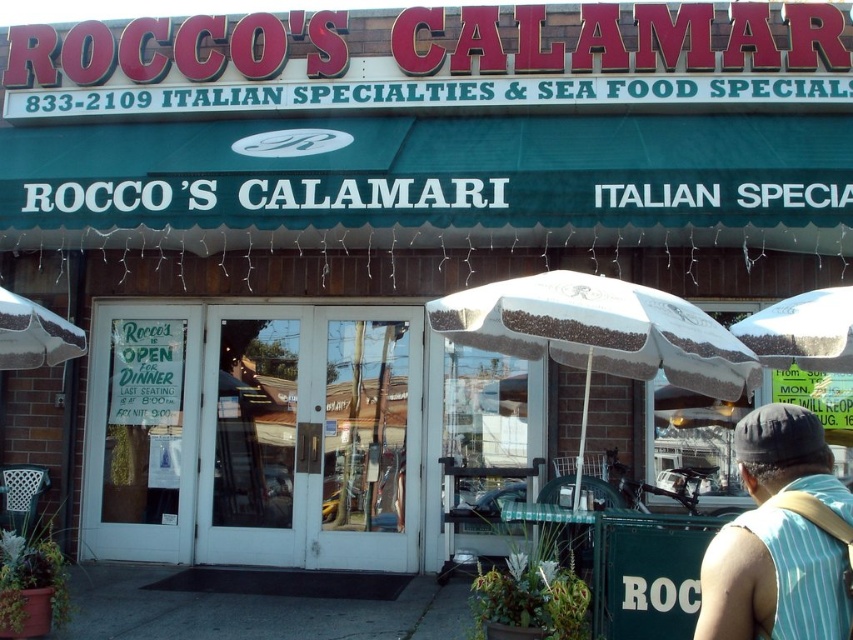
In the scene shown: Which of these two, white textured umbrella at center or white textured umbrella at left, stands shorter?

Standing shorter between the two is white textured umbrella at left.

The width and height of the screenshot is (853, 640). I want to click on white textured umbrella at center, so click(x=599, y=332).

Find the location of a particular element. The width and height of the screenshot is (853, 640). white textured umbrella at center is located at coordinates (599, 332).

Based on the photo, which of these two, white textured umbrella at center or striped sleeveless shirt at lower right, stands taller?

white textured umbrella at center is taller.

Is point (561, 321) farther from viewer compared to point (753, 483)?

Yes.

The height and width of the screenshot is (640, 853). Identify the location of white textured umbrella at center. (599, 332).

Can you confirm if white fabric umbrella at center is thinner than white textured umbrella at left?

Indeed, white fabric umbrella at center has a lesser width compared to white textured umbrella at left.

Which is behind, point (840, 352) or point (44, 360)?

Positioned behind is point (44, 360).

Between point (795, 301) and point (51, 316), which one is positioned in front?

Point (795, 301)

Where is `white fabric umbrella at center`? white fabric umbrella at center is located at coordinates (802, 332).